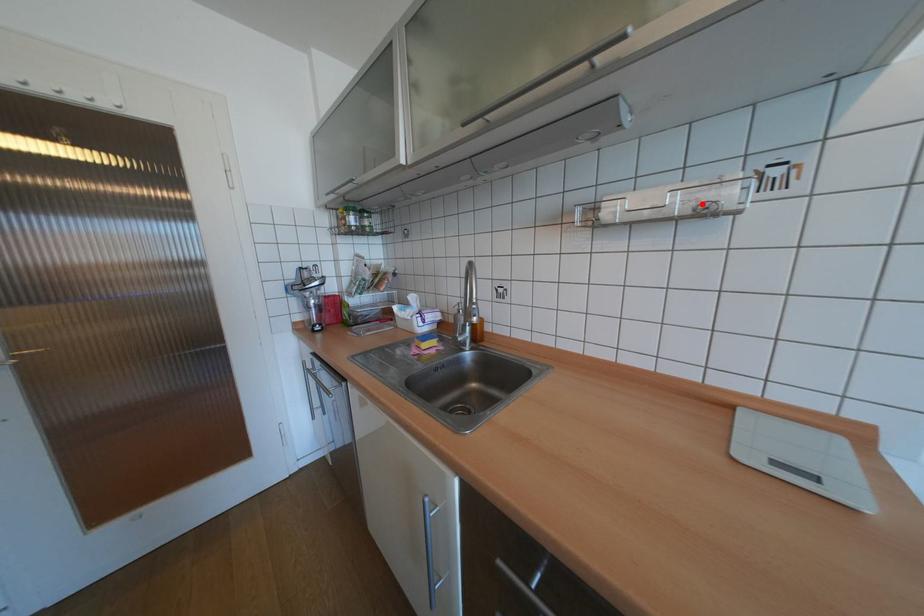
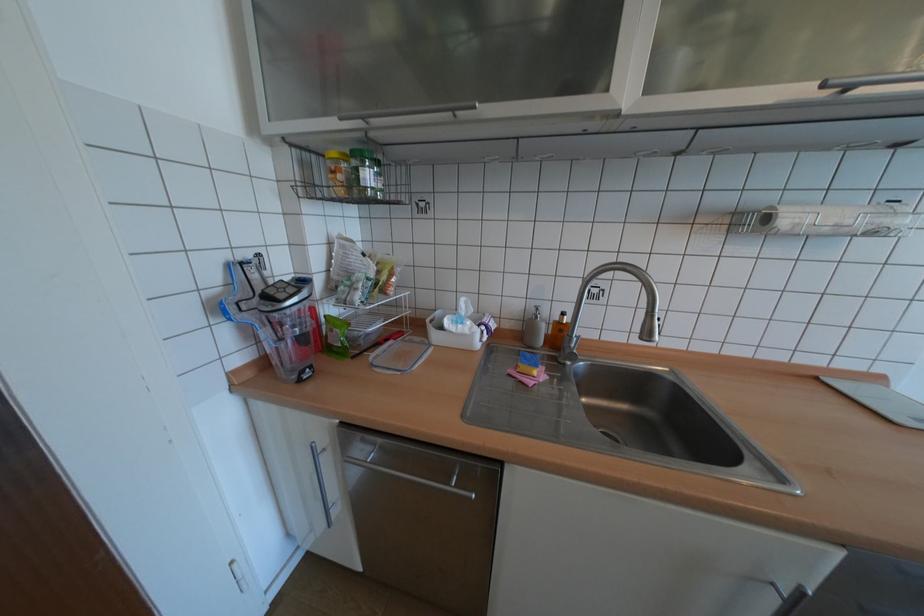
Question: I am providing you with two images of the same scene from different viewpoints. A red point is marked on the first image. At the location where the point appears in image 1, is it still visible in image 2?

Choices:
 (A) Yes
 (B) No

Answer: (A)